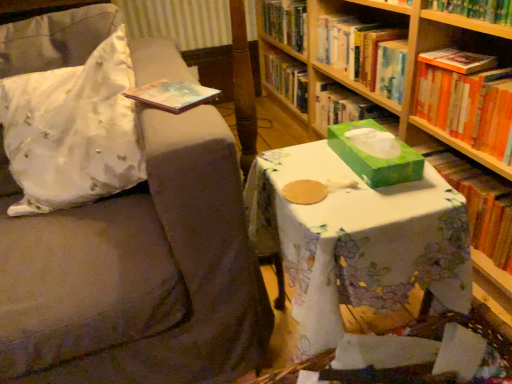
Question: In terms of width, does orange hardcover book at right, the second book positioned from the bottom, look wider or thinner when compared to green paper book at right, arranged as the 3th book when viewed from the top?

Choices:
 (A) wide
 (B) thin

Answer: (A)

Question: In the image, is orange hardcover book at right, the second book positioned from the bottom, positioned in front of or behind green paper book at right, arranged as the 3th book when viewed from the top?

Choices:
 (A) front
 (B) behind

Answer: (A)

Question: Considering the real-world distances, which object is closest to the green paper book at right, which ranks as the 1th book in bottom-to-top order?

Choices:
 (A) orange hardcover book at right, the second book positioned from the bottom
 (B) white satin pillow at upper left
 (C) floral-patterned cloth at center
 (D) green cardboard bookcase at center
 (E) hardcover book at upper right, the 1th book positioned from the top

Answer: (A)

Question: Which of these objects is positioned closest to the hardcover book at upper right, the 1th book positioned from the top?

Choices:
 (A) white satin pillow at upper left
 (B) orange hardcover book at right, placed as the 2th book when sorted from top to bottom
 (C) green cardboard bookcase at center
 (D) matte gray swivel chair at center
 (E) green paper tissue box at center

Answer: (C)